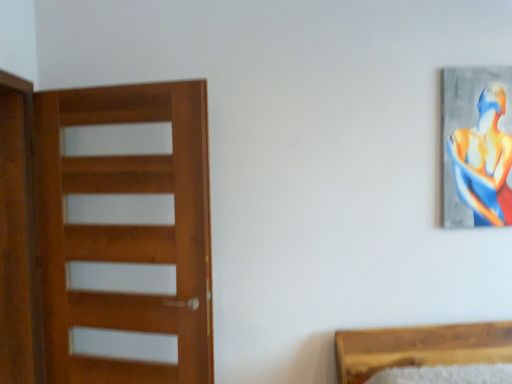
Question: From a real-world perspective, is metallic silver painting at upper right positioned under brown wooden screen door at left based on gravity?

Choices:
 (A) yes
 (B) no

Answer: (B)

Question: From the image's perspective, is metallic silver painting at upper right over brown wooden screen door at left?

Choices:
 (A) yes
 (B) no

Answer: (A)

Question: Are metallic silver painting at upper right and brown wooden screen door at left beside each other?

Choices:
 (A) yes
 (B) no

Answer: (B)

Question: Considering the relative positions of metallic silver painting at upper right and brown wooden screen door at left in the image provided, is metallic silver painting at upper right to the left of brown wooden screen door at left from the viewer's perspective?

Choices:
 (A) yes
 (B) no

Answer: (B)

Question: From a real-world perspective, is metallic silver painting at upper right on top of brown wooden screen door at left?

Choices:
 (A) yes
 (B) no

Answer: (A)

Question: From the image's perspective, is brown wooden screen door at left located above or below wooden door at left?

Choices:
 (A) above
 (B) below

Answer: (A)

Question: Would you say brown wooden screen door at left is to the left or to the right of wooden door at left in the picture?

Choices:
 (A) right
 (B) left

Answer: (B)

Question: Considering the positions of brown wooden screen door at left and wooden door at left in the image, is brown wooden screen door at left taller or shorter than wooden door at left?

Choices:
 (A) short
 (B) tall

Answer: (B)

Question: In the image, is brown wooden screen door at left positioned in front of or behind wooden door at left?

Choices:
 (A) front
 (B) behind

Answer: (B)

Question: Considering the positions of point pyautogui.click(x=54, y=379) and point pyautogui.click(x=33, y=254), is point pyautogui.click(x=54, y=379) closer or farther from the camera than point pyautogui.click(x=33, y=254)?

Choices:
 (A) farther
 (B) closer

Answer: (B)

Question: From the image's perspective, is wooden door at left located above or below brown wooden screen door at left?

Choices:
 (A) above
 (B) below

Answer: (B)

Question: Is wooden door at left taller or shorter than brown wooden screen door at left?

Choices:
 (A) short
 (B) tall

Answer: (A)

Question: Is wooden door at left in front of or behind brown wooden screen door at left in the image?

Choices:
 (A) behind
 (B) front

Answer: (B)

Question: From a real-world perspective, is metallic silver painting at upper right positioned above or below wooden door at left?

Choices:
 (A) above
 (B) below

Answer: (A)

Question: In the image, is metallic silver painting at upper right on the left side or the right side of wooden door at left?

Choices:
 (A) right
 (B) left

Answer: (A)